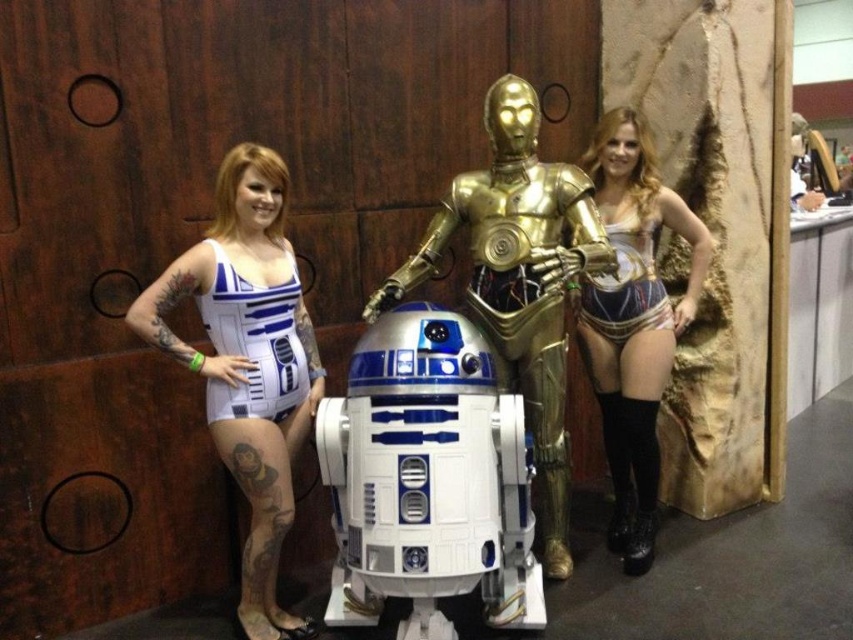
You are a photographer setting up a photo shoot with the gold metallic robot at center and the matte gold bikini at center. You need to position them so that both are fully visible in the frame. Given their heights, which object should be placed closer to the camera to ensure the shorter one isn

The gold metallic robot at center is taller than the matte gold bikini at center. To ensure both are fully visible, the shorter matte gold bikini at center should be placed closer to the camera so that its full height is captured without being obscured by the taller robot.

You are a photographer setting up for a group photo. The gold metallic robot at center and the white matte swimsuit at left are part of the setup. You need to ensure there is at least 24 inches between them for proper lighting. Based on the current positioning, will you need to adjust their positions?

The distance between the gold metallic robot at center and the white matte swimsuit at left is 23.19 inches, which is less than the required 24 inches. Therefore, you need to adjust their positions to meet the lighting requirement.

You are planning to take a photo of the white matte swimsuit at left and metallic gold armor at center. Which one appears shorter in the photo?

The white matte swimsuit at left appears shorter than the metallic gold armor at center because it is not as tall as the metallic gold armor at center.